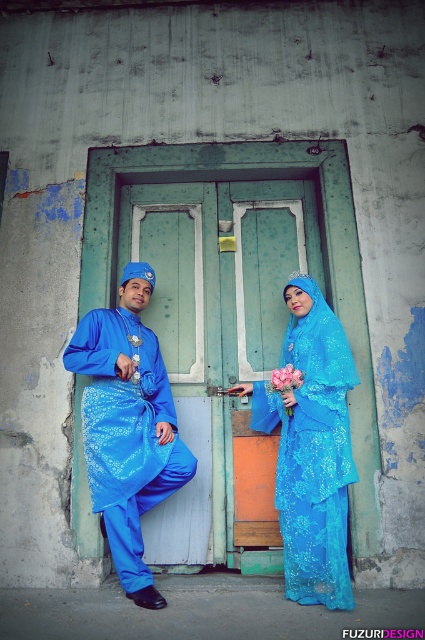
Question: Observing the image, what is the correct spatial positioning of shiny blue dress at center in reference to matte pink flower at center?

Choices:
 (A) right
 (B) left

Answer: (B)

Question: From the image, what is the correct spatial relationship of green wooden door at center in relation to matte pink flower at center?

Choices:
 (A) left
 (B) right

Answer: (A)

Question: Is green wooden door at center to the left of shiny blue dress at center from the viewer's perspective?

Choices:
 (A) yes
 (B) no

Answer: (A)

Question: Which object is positioned farthest from the green wooden door at center?

Choices:
 (A) matte pink flower at center
 (B) shiny blue dress at center

Answer: (A)

Question: Which of the following is the farthest from the observer?

Choices:
 (A) matte blue kurta at center
 (B) matte pink flower at center

Answer: (B)

Question: Based on their relative distances, which object is nearer to the green wooden door at center?

Choices:
 (A) shiny blue dress at center
 (B) matte pink flower at center
 (C) matte blue kurta at center

Answer: (A)